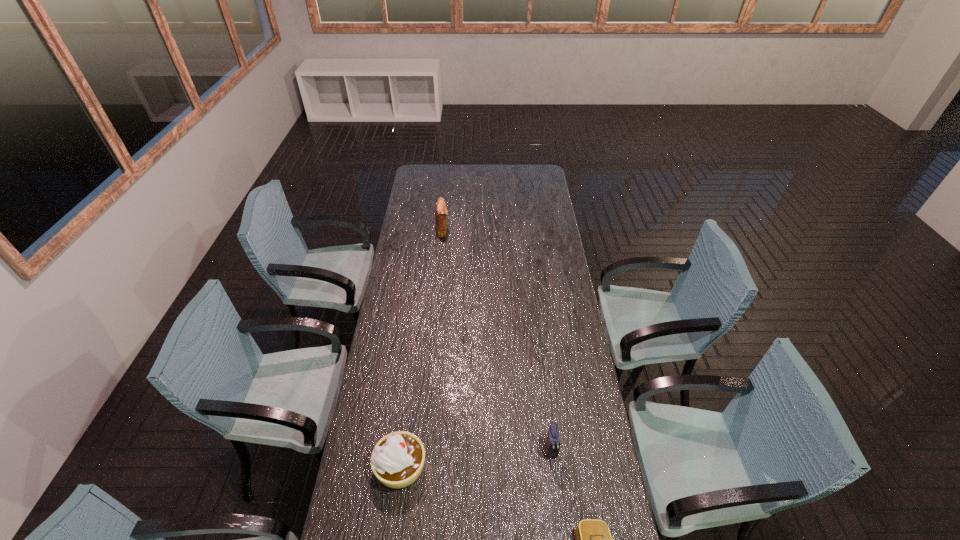
The image size is (960, 540). Find the location of `the second closest clutch bag relative to the whipped cream`. the second closest clutch bag relative to the whipped cream is located at coordinates (593, 539).

The height and width of the screenshot is (540, 960). I want to click on the second closest clutch bag to the second object from right to left, so click(441, 212).